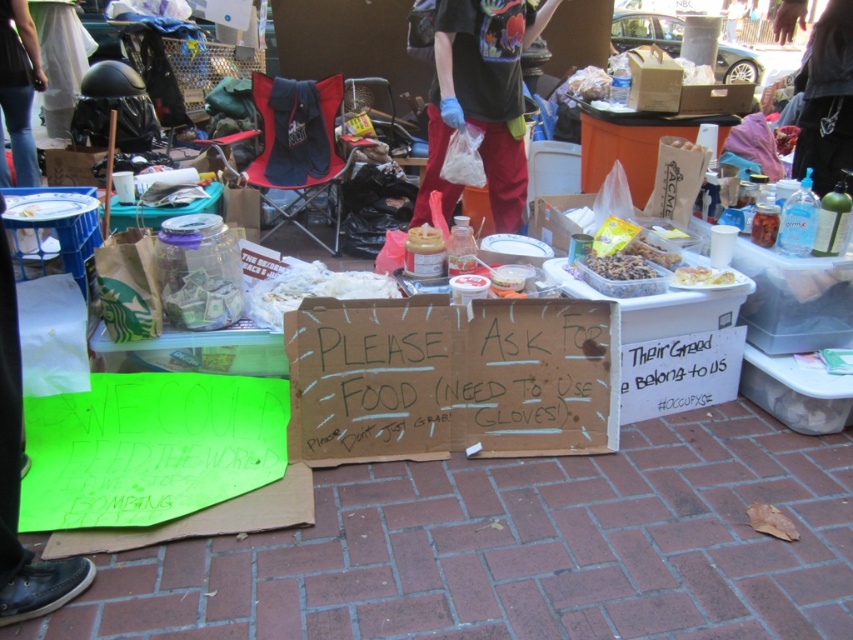
Based on the photo, who is taller, brick pavement at center or dark brown textured nuts at center?

With more height is brick pavement at center.

Looking at this image, does brick pavement at center appear on the left side of dark brown textured nuts at center?

Correct, you'll find brick pavement at center to the left of dark brown textured nuts at center.

Does point (473, 468) come closer to viewer compared to point (637, 257)?

That is True.

Identify the location of brick pavement at center. The width and height of the screenshot is (853, 640). (519, 548).

Can you confirm if black t-shirt at center is positioned to the left of dark brown textured nuts at center?

Indeed, black t-shirt at center is positioned on the left side of dark brown textured nuts at center.

Does point (488, 13) lie in front of point (599, 273)?

That is False.

Is point (534, 10) positioned after point (596, 262)?

Yes, point (534, 10) is behind point (596, 262).

Image resolution: width=853 pixels, height=640 pixels. Find the location of `black t-shirt at center`. black t-shirt at center is located at coordinates (480, 99).

In the scene shown: Which is more to the right, dark brown textured nuts at center or crumbly brown granola bar at center?

Positioned to the right is crumbly brown granola bar at center.

Does dark brown textured nuts at center have a greater height compared to crumbly brown granola bar at center?

In fact, dark brown textured nuts at center may be shorter than crumbly brown granola bar at center.

Who is more distant from viewer, (595, 260) or (643, 246)?

Positioned behind is point (643, 246).

Where is `dark brown textured nuts at center`? This screenshot has height=640, width=853. dark brown textured nuts at center is located at coordinates click(x=619, y=266).